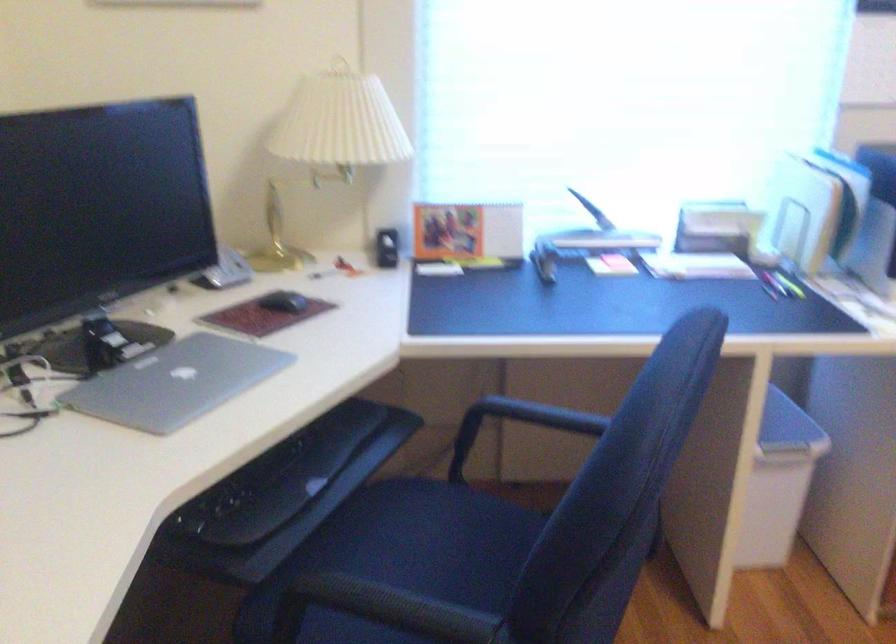
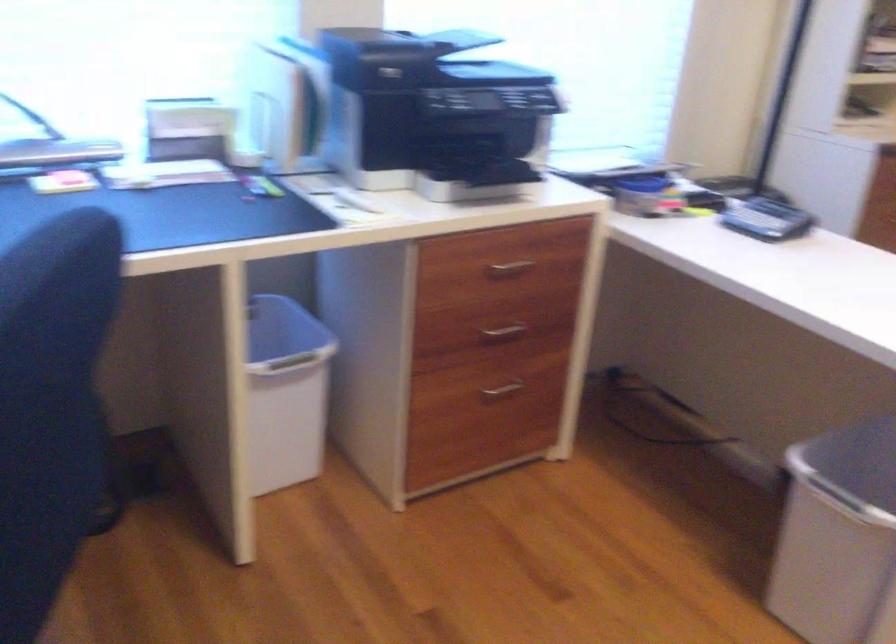
Question: How did the camera likely rotate?

Choices:
 (A) Left
 (B) Right
 (C) Up
 (D) Down

Answer: (B)